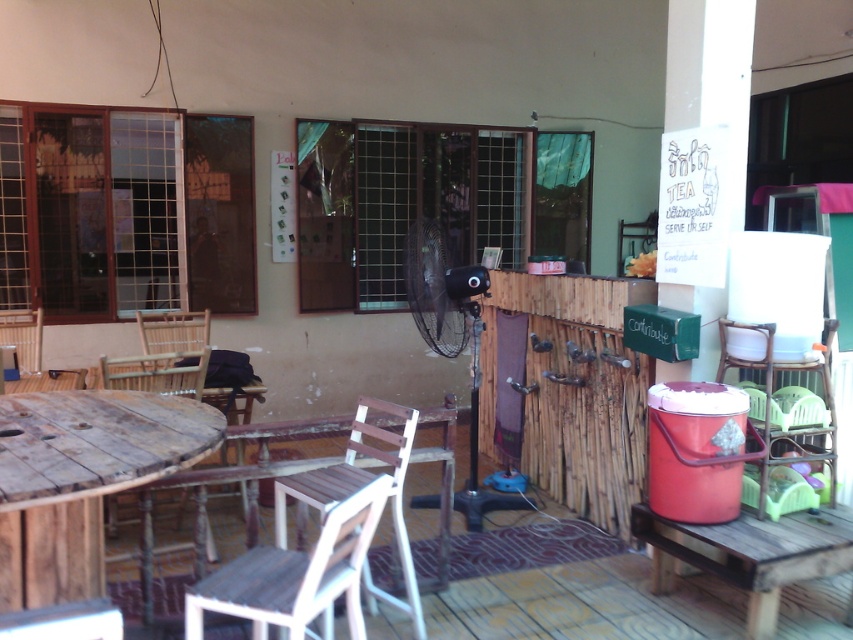
Does wooden chair at lower left have a greater height compared to wooden chair at left?

Answer: No, wooden chair at lower left is not taller than wooden chair at left.

Looking at this image, which is more to the left, wooden chair at lower left or wooden chair at left?

wooden chair at left is more to the left.

This screenshot has width=853, height=640. Describe the element at coordinates (157, 372) in the screenshot. I see `wooden chair at lower left` at that location.

Find the location of a particular element. This screenshot has height=640, width=853. wooden chair at lower left is located at coordinates (157, 372).

This screenshot has height=640, width=853. I want to click on white wood chair at lower left, so click(294, 573).

Is white wood chair at lower left taller than wooden chair at left?

Yes.

Describe the element at coordinates (294, 573) in the screenshot. The width and height of the screenshot is (853, 640). I see `white wood chair at lower left` at that location.

I want to click on white wood chair at lower left, so click(x=294, y=573).

Who is positioned more to the right, white wood chair at lower left or white wood chair at center?

white wood chair at center

Does white wood chair at lower left appear on the right side of white wood chair at center?

Incorrect, white wood chair at lower left is not on the right side of white wood chair at center.

Is point (334, 541) closer to camera compared to point (358, 403)?

Yes, point (334, 541) is in front of point (358, 403).

What are the coordinates of `white wood chair at lower left` in the screenshot? It's located at (294, 573).